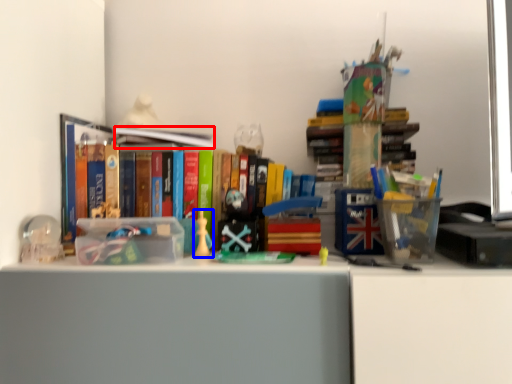
Question: Which point is further to the camera, book (highlighted by a red box) or toy (highlighted by a blue box)?

Choices:
 (A) book
 (B) toy

Answer: (A)